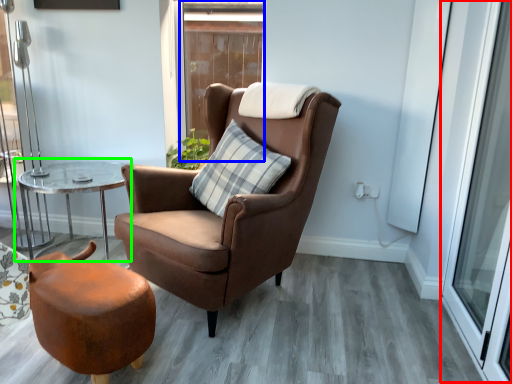
Question: Which object is the farthest from screen door (highlighted by a red box)? Choose among these: window (highlighted by a blue box) or table (highlighted by a green box).

Choices:
 (A) window
 (B) table

Answer: (A)